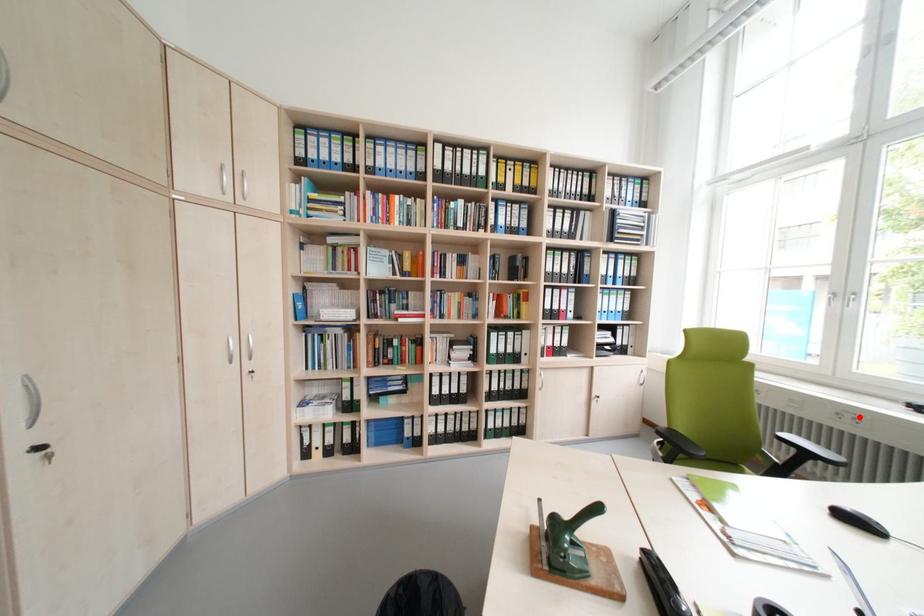
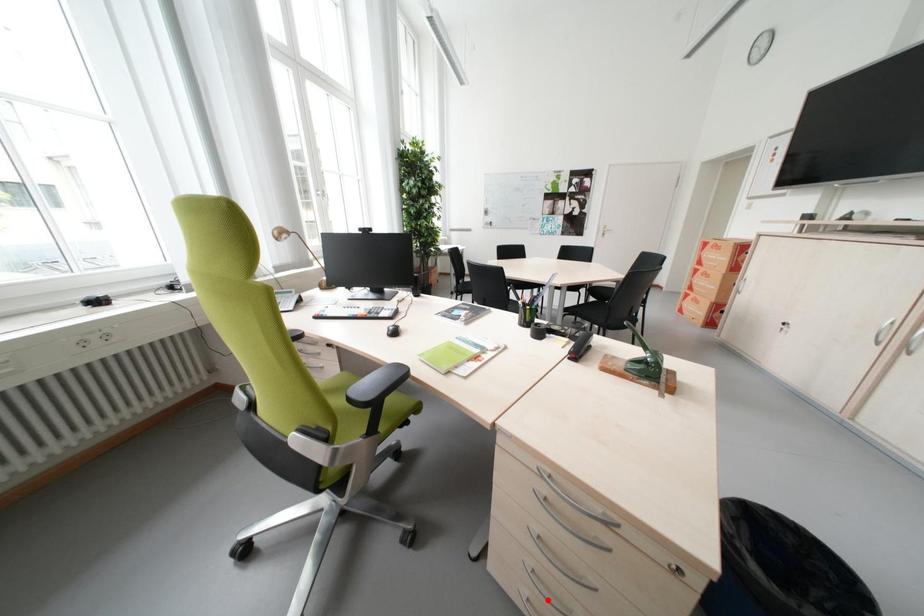
I am providing you with two images of the same scene from different viewpoints. A red point is marked on the first image and another point is marked on the second image. Are the points marked in image1 and image2 representing the same 3D position?

No